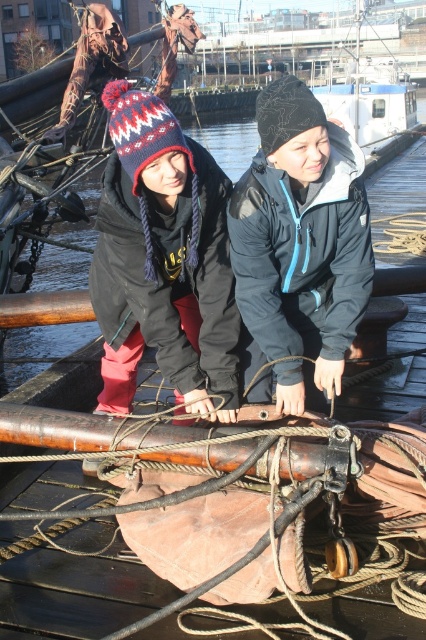
Between knitted woolen hat at center and white plastic boat at upper center, which one has less height?

knitted woolen hat at center

Is the position of knitted woolen hat at center more distant than that of white plastic boat at upper center?

That is False.

Describe the element at coordinates (230, 252) in the screenshot. I see `knitted woolen hat at center` at that location.

Where is `knitted woolen hat at center`? This screenshot has width=426, height=640. knitted woolen hat at center is located at coordinates (230, 252).